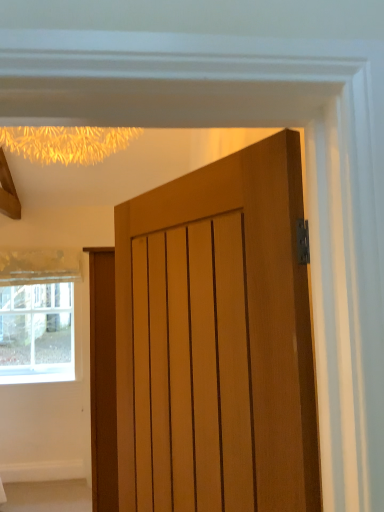
Question: Considering the relative sizes of wooden door at center and clear glass window at lower left in the image provided, is wooden door at center wider than clear glass window at lower left?

Choices:
 (A) no
 (B) yes

Answer: (B)

Question: Is wooden door at center in front of clear glass window at lower left?

Choices:
 (A) no
 (B) yes

Answer: (B)

Question: From the image's perspective, does wooden door at center appear lower than clear glass window at lower left?

Choices:
 (A) no
 (B) yes

Answer: (A)

Question: Can you confirm if wooden door at center is positioned to the right of clear glass window at lower left?

Choices:
 (A) yes
 (B) no

Answer: (A)

Question: Does wooden door at center have a larger size compared to clear glass window at lower left?

Choices:
 (A) yes
 (B) no

Answer: (A)

Question: From the image's perspective, does wooden door at center appear higher than clear glass window at lower left?

Choices:
 (A) no
 (B) yes

Answer: (B)

Question: Considering the relative sizes of clear glass window at lower left and wooden door at center in the image provided, is clear glass window at lower left wider than wooden door at center?

Choices:
 (A) yes
 (B) no

Answer: (B)

Question: Can you confirm if clear glass window at lower left is shorter than wooden door at center?

Choices:
 (A) yes
 (B) no

Answer: (A)

Question: Is clear glass window at lower left in front of wooden door at center?

Choices:
 (A) yes
 (B) no

Answer: (B)

Question: From the image's perspective, is clear glass window at lower left above wooden door at center?

Choices:
 (A) no
 (B) yes

Answer: (A)

Question: Is clear glass window at lower left at the left side of wooden door at center?

Choices:
 (A) no
 (B) yes

Answer: (B)

Question: Are clear glass window at lower left and wooden door at center beside each other?

Choices:
 (A) yes
 (B) no

Answer: (B)

Question: Looking at their shapes, would you say wooden door at center is wider or thinner than clear glass window at lower left?

Choices:
 (A) thin
 (B) wide

Answer: (B)